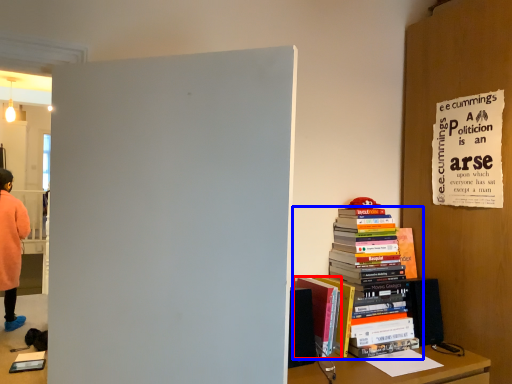
Question: Which of the following is the closest to the observer, book (highlighted by a red box) or book (highlighted by a blue box)?

Choices:
 (A) book
 (B) book

Answer: (A)